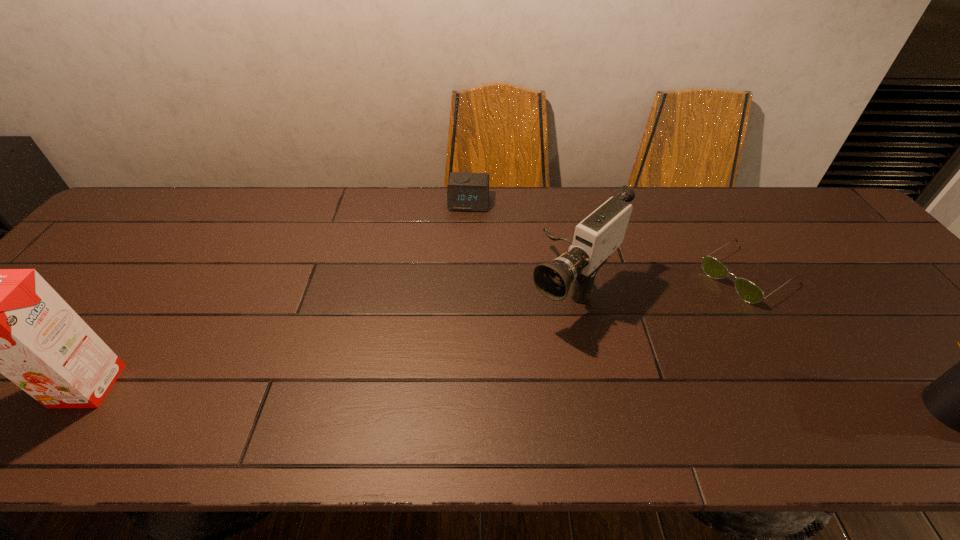
In order to click on vacant region located on the front-facing side of the shortest object in this screenshot , I will do `click(679, 319)`.

Where is `free space located 0.280m on the front-facing side of the shortest object`? This screenshot has width=960, height=540. free space located 0.280m on the front-facing side of the shortest object is located at coordinates point(642,343).

The image size is (960, 540). Find the location of `vacant region located on the recording direction of the third object from left to right`. vacant region located on the recording direction of the third object from left to right is located at coordinates (483, 388).

The width and height of the screenshot is (960, 540). What are the coordinates of `vacant area situated on the recording direction of the third object from left to right` in the screenshot? It's located at (473, 398).

Find the location of a particular element. vacant space located on the recording direction of the third object from left to right is located at coordinates (504, 368).

Where is `vacant space located on the front-facing side of the fourth tallest object`? This screenshot has width=960, height=540. vacant space located on the front-facing side of the fourth tallest object is located at coordinates (460, 268).

Image resolution: width=960 pixels, height=540 pixels. Find the location of `free spot located on the front-facing side of the fourth tallest object`. free spot located on the front-facing side of the fourth tallest object is located at coordinates (466, 225).

In order to click on free space located 0.070m on the front-facing side of the fourth tallest object in this screenshot , I will do `click(466, 227)`.

You are a GUI agent. You are given a task and a screenshot of the screen. Output one action in this format:
    pyautogui.click(x=<x>, y=<y>)
    Task: Click on the object located at the far edge
    
    Given the screenshot: What is the action you would take?
    [x=465, y=191]

Locate an element on the screen. This screenshot has width=960, height=540. object located at the near edge is located at coordinates (11, 321).